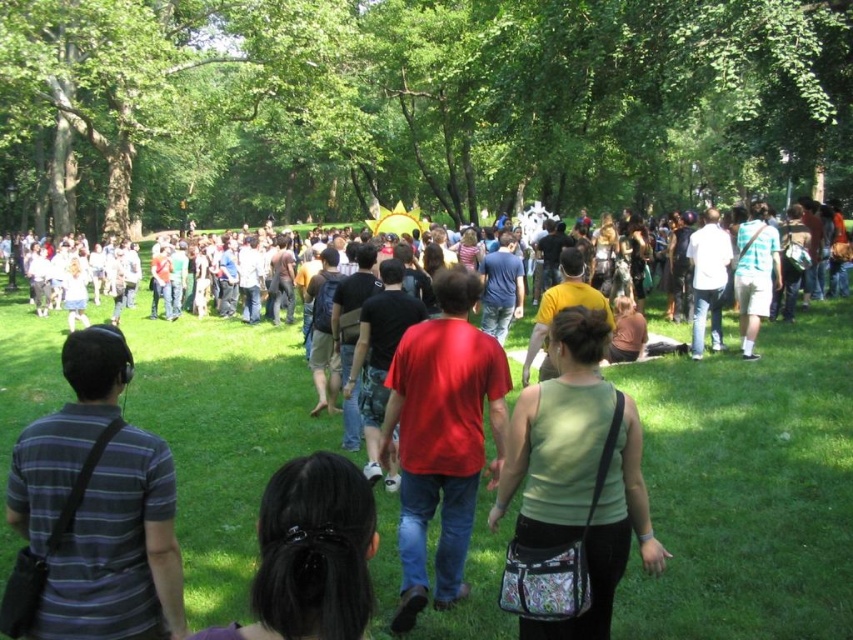
Question: Does matte black shirt at center come in front of striped cotton shirt at left?

Choices:
 (A) yes
 (B) no

Answer: (B)

Question: Does black hair at center have a larger size compared to light blue shirt at center?

Choices:
 (A) no
 (B) yes

Answer: (B)

Question: Among these points, which one is nearest to the camera?

Choices:
 (A) (352, 625)
 (B) (749, 280)
 (C) (44, 499)

Answer: (A)

Question: Estimate the real-world distances between objects in this image. Which object is farther from the red matte shirt at center?

Choices:
 (A) striped cotton shirt at left
 (B) green fabric purse at center

Answer: (A)

Question: Which object appears closest to the camera in this image?

Choices:
 (A) red matte shirt at center
 (B) light blue shirt at center
 (C) green fabric purse at center
 (D) striped cotton shirt at left

Answer: (D)

Question: Where is matte black shirt at center located in relation to black hair at center in the image?

Choices:
 (A) below
 (B) above

Answer: (A)